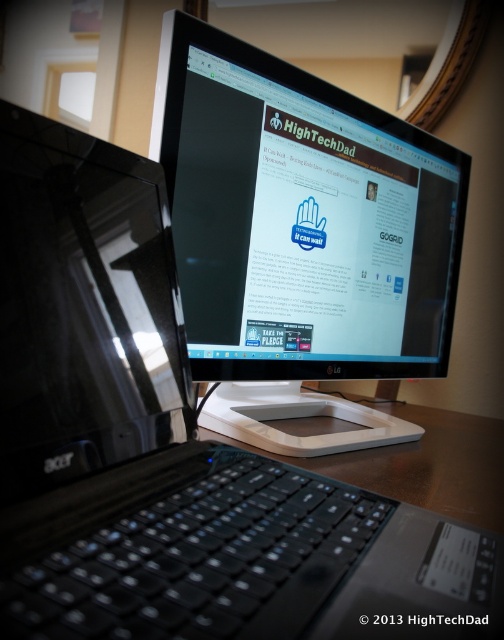
Question: Which is farther from the black glossy monitor at upper center?

Choices:
 (A) glossy black monitor at center
 (B) brown wooden table at center

Answer: (A)

Question: Which point is closer to the camera?

Choices:
 (A) brown wooden table at center
 (B) black glossy monitor at upper center
 (C) glossy black monitor at center

Answer: (C)

Question: Is glossy black monitor at center closer to the viewer compared to brown wooden table at center?

Choices:
 (A) no
 (B) yes

Answer: (B)

Question: Is black glossy monitor at upper center to the right of brown wooden table at center from the viewer's perspective?

Choices:
 (A) yes
 (B) no

Answer: (B)

Question: Which is nearer to the black glossy monitor at upper center?

Choices:
 (A) glossy black monitor at center
 (B) brown wooden table at center

Answer: (B)

Question: Is black glossy monitor at upper center above glossy black monitor at center?

Choices:
 (A) yes
 (B) no

Answer: (A)